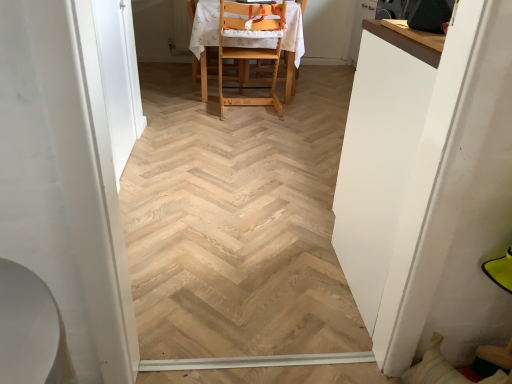
Question: Can you confirm if white glossy table at right is smaller than light wood highchair at center?

Choices:
 (A) no
 (B) yes

Answer: (B)

Question: Is white glossy table at right positioned beyond the bounds of light wood highchair at center?

Choices:
 (A) no
 (B) yes

Answer: (B)

Question: Would you say light wood highchair at center is part of white glossy table at right's contents?

Choices:
 (A) no
 (B) yes

Answer: (A)

Question: Is white glossy table at right thinner than light wood highchair at center?

Choices:
 (A) yes
 (B) no

Answer: (A)

Question: From a real-world perspective, is white glossy table at right under light wood highchair at center?

Choices:
 (A) yes
 (B) no

Answer: (B)

Question: From a real-world perspective, is white glossy table at right over light wood highchair at center?

Choices:
 (A) no
 (B) yes

Answer: (B)

Question: Are light wood highchair at center and white glossy table at right beside each other?

Choices:
 (A) no
 (B) yes

Answer: (A)

Question: Is light wood highchair at center wider than white glossy table at right?

Choices:
 (A) no
 (B) yes

Answer: (B)

Question: From a real-world perspective, does light wood highchair at center sit lower than white glossy table at right?

Choices:
 (A) yes
 (B) no

Answer: (A)

Question: Is light wood highchair at center not close to white glossy table at right?

Choices:
 (A) no
 (B) yes

Answer: (B)

Question: Is light wood highchair at center to the left of white glossy table at right from the viewer's perspective?

Choices:
 (A) yes
 (B) no

Answer: (A)

Question: Does light wood highchair at center have a smaller size compared to white glossy table at right?

Choices:
 (A) yes
 (B) no

Answer: (B)

Question: Does white glossy table at right appear on the left side of white glossy door at left, acting as the second screen door starting from the front?

Choices:
 (A) yes
 (B) no

Answer: (B)